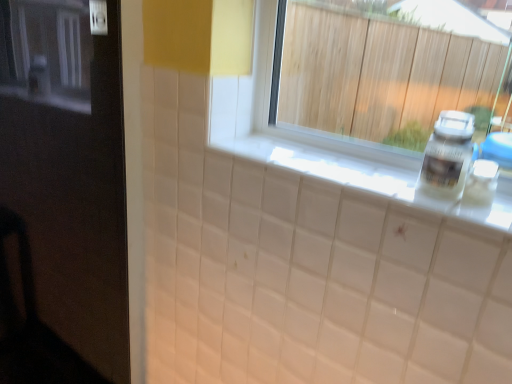
Image resolution: width=512 pixels, height=384 pixels. Find the location of `free location above white glossy counter top at center (from a real-world perspective)`. free location above white glossy counter top at center (from a real-world perspective) is located at coordinates (336, 164).